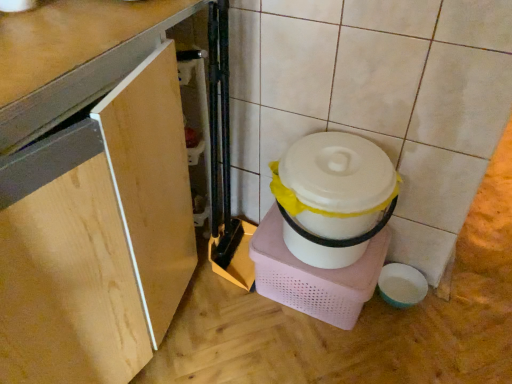
Question: Is wooden cabinet at lower left spatially inside white plastic container at center-right, or outside of it?

Choices:
 (A) outside
 (B) inside

Answer: (A)

Question: In the image, is wooden cabinet at lower left positioned in front of or behind white plastic container at center-right?

Choices:
 (A) behind
 (B) front

Answer: (B)

Question: From a real-world perspective, is wooden cabinet at lower left above or below white plastic container at center-right?

Choices:
 (A) below
 (B) above

Answer: (B)

Question: From the image's perspective, is white plastic container at center-right positioned above or below wooden cabinet at lower left?

Choices:
 (A) below
 (B) above

Answer: (A)

Question: In terms of width, does white plastic container at center-right look wider or thinner when compared to wooden cabinet at lower left?

Choices:
 (A) thin
 (B) wide

Answer: (A)

Question: In the image, is white plastic container at center-right on the left side or the right side of wooden cabinet at lower left?

Choices:
 (A) left
 (B) right

Answer: (B)

Question: Is white plastic container at center-right in front of or behind wooden cabinet at lower left in the image?

Choices:
 (A) front
 (B) behind

Answer: (B)